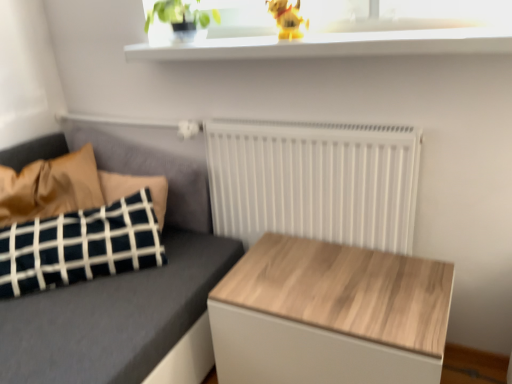
Question: Does white matte radiator at center have a lesser width compared to wooden table at center?

Choices:
 (A) no
 (B) yes

Answer: (B)

Question: Is white matte radiator at center to the left of wooden table at center from the viewer's perspective?

Choices:
 (A) yes
 (B) no

Answer: (A)

Question: Would you say white matte radiator at center is outside wooden table at center?

Choices:
 (A) no
 (B) yes

Answer: (B)

Question: Is white matte radiator at center facing towards wooden table at center?

Choices:
 (A) no
 (B) yes

Answer: (B)

Question: Is white matte radiator at center closer to camera compared to wooden table at center?

Choices:
 (A) yes
 (B) no

Answer: (B)

Question: Considering the positions of dark gray fabric couch at left and white glossy window sill at upper center in the image, is dark gray fabric couch at left bigger or smaller than white glossy window sill at upper center?

Choices:
 (A) small
 (B) big

Answer: (B)

Question: Does point (x=28, y=322) appear closer or farther from the camera than point (x=443, y=46)?

Choices:
 (A) farther
 (B) closer

Answer: (A)

Question: Would you say dark gray fabric couch at left is to the left or to the right of white glossy window sill at upper center in the picture?

Choices:
 (A) left
 (B) right

Answer: (A)

Question: Is dark gray fabric couch at left spatially inside white glossy window sill at upper center, or outside of it?

Choices:
 (A) inside
 (B) outside

Answer: (B)

Question: Is point (113, 142) closer or farther from the camera than point (165, 0)?

Choices:
 (A) closer
 (B) farther

Answer: (B)

Question: From the image's perspective, is dark gray fabric couch at left located above or below green matte plant at upper center?

Choices:
 (A) above
 (B) below

Answer: (B)

Question: Would you say dark gray fabric couch at left is to the left or to the right of green matte plant at upper center in the picture?

Choices:
 (A) left
 (B) right

Answer: (A)

Question: Looking at their shapes, would you say dark gray fabric couch at left is wider or thinner than green matte plant at upper center?

Choices:
 (A) thin
 (B) wide

Answer: (B)

Question: Looking at their shapes, would you say green matte plant at upper center is wider or thinner than wooden table at center?

Choices:
 (A) wide
 (B) thin

Answer: (B)

Question: From the image's perspective, relative to wooden table at center, is green matte plant at upper center above or below?

Choices:
 (A) below
 (B) above

Answer: (B)